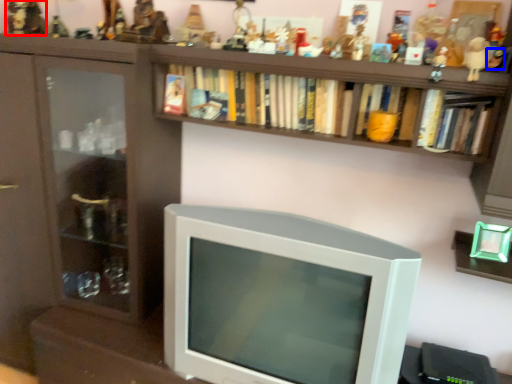
Question: Which object is closer to the camera taking this photo, toy (highlighted by a red box) or toy (highlighted by a blue box)?

Choices:
 (A) toy
 (B) toy

Answer: (B)